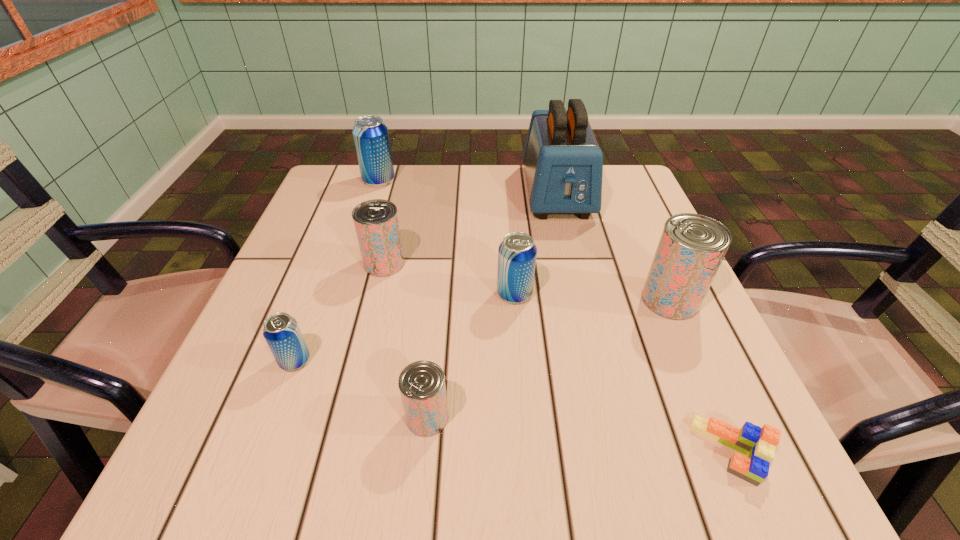
This screenshot has width=960, height=540. In order to click on the third nearest object in this screenshot , I will do `click(281, 331)`.

Locate an element on the screen. Image resolution: width=960 pixels, height=540 pixels. the nearest blue beer can is located at coordinates (281, 331).

Identify the location of the third beer can from right to left. (422, 387).

Where is `the nearest red beer can`? The image size is (960, 540). the nearest red beer can is located at coordinates (422, 387).

At what (x,y) coordinates should I click in order to perform the action: click on Lego. Please return your answer as a coordinate pair (x, y). Looking at the image, I should click on (758, 444).

Identify the location of orange Lego. (758, 444).

Find the location of a particular element. This screenshot has width=960, height=540. free location located on the front-facing side of the toaster is located at coordinates (596, 360).

This screenshot has height=540, width=960. In order to click on vacant space located on the right of the farthest beer can in this screenshot , I will do `click(538, 181)`.

At what (x,y) coordinates should I click in order to perform the action: click on free region located on the left of the second farthest red beer can. Please return your answer as a coordinate pair (x, y). Image resolution: width=960 pixels, height=540 pixels. Looking at the image, I should click on (467, 300).

Locate an element on the screen. The height and width of the screenshot is (540, 960). free location located 0.240m on the back of the fifth nearest beer can is located at coordinates (401, 191).